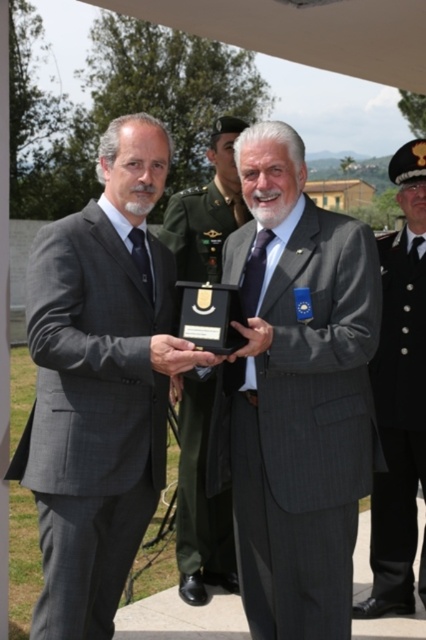
Question: Is matte gray suit at center closer to the viewer compared to gray pinstripe suit at center?

Choices:
 (A) no
 (B) yes

Answer: (A)

Question: Can you confirm if matte gray suit at center is positioned to the right of gray pinstripe suit at center?

Choices:
 (A) yes
 (B) no

Answer: (A)

Question: Which object is positioned closest to the matte black plaque at center?

Choices:
 (A) gray pinstripe suit at center
 (B) black uniform at right
 (C) matte gray suit at center

Answer: (A)

Question: Is matte gray suit at center thinner than gray pinstripe suit at center?

Choices:
 (A) no
 (B) yes

Answer: (B)

Question: Among these objects, which one is nearest to the camera?

Choices:
 (A) black uniform at right
 (B) matte gray suit at center
 (C) gray pinstripe suit at center

Answer: (C)

Question: Which object is closer to the camera taking this photo?

Choices:
 (A) matte gray suit at center
 (B) matte black plaque at center
 (C) gray pinstripe suit at center

Answer: (C)